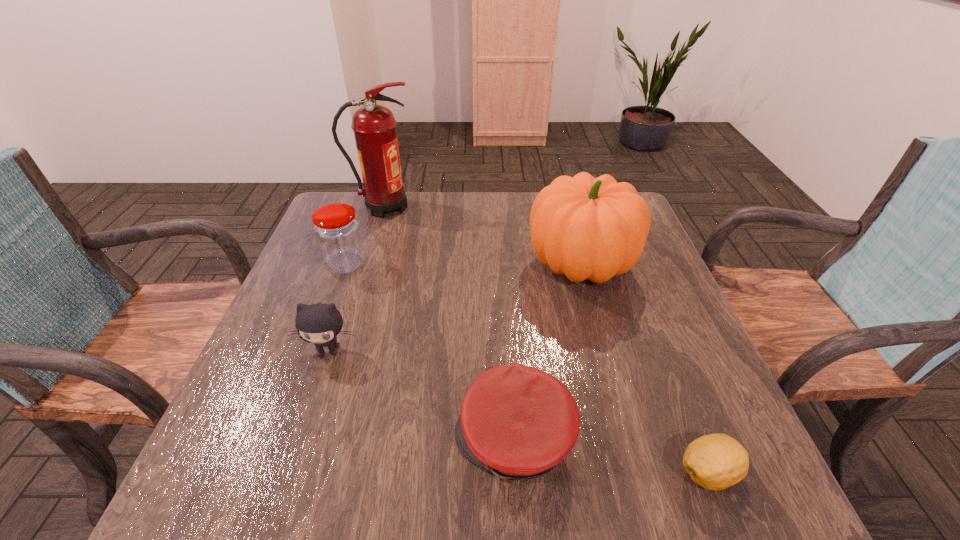
Where is `vacant area that lies between the lemon and the cap`? vacant area that lies between the lemon and the cap is located at coordinates [612, 456].

Choose which object is the fourth nearest neighbor to the farthest object. Please provide its 2D coordinates. Your answer should be formatted as a tuple, i.e. [(x, y)], where the tuple contains the x and y coordinates of a point satisfying the conditions above.

[(518, 422)]

Locate which object is the third closest to the cap. Please provide its 2D coordinates. Your answer should be formatted as a tuple, i.e. [(x, y)], where the tuple contains the x and y coordinates of a point satisfying the conditions above.

[(591, 228)]

At what (x,y) coordinates should I click in order to perform the action: click on free space in the image that satisfies the following two spatial constraints: 1. on the front side of the pumpkin; 2. on the front of the cap with an emblem. Please return your answer as a coordinate pair (x, y). This screenshot has height=540, width=960. Looking at the image, I should click on (629, 440).

This screenshot has height=540, width=960. In order to click on free location that satisfies the following two spatial constraints: 1. on the front-facing side of the fire extinguisher; 2. on the front-facing side of the fourth farthest object in this screenshot , I will do `click(341, 350)`.